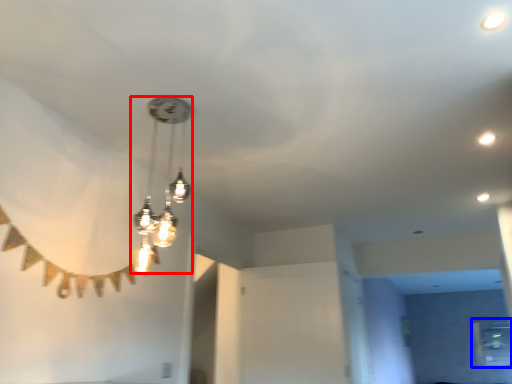
Question: Which of the following is the closest to the observer, lamp (highlighted by a red box) or window (highlighted by a blue box)?

Choices:
 (A) lamp
 (B) window

Answer: (A)